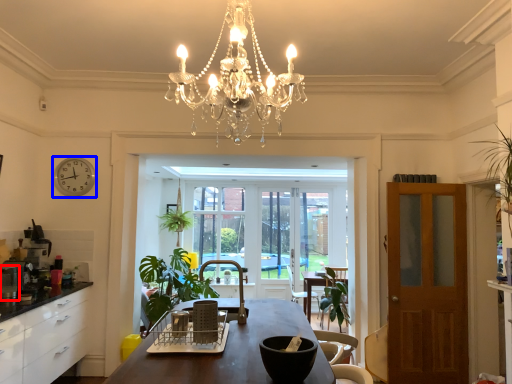
Question: Which object is closer to the camera taking this photo, appliance (highlighted by a red box) or clock (highlighted by a blue box)?

Choices:
 (A) appliance
 (B) clock

Answer: (A)